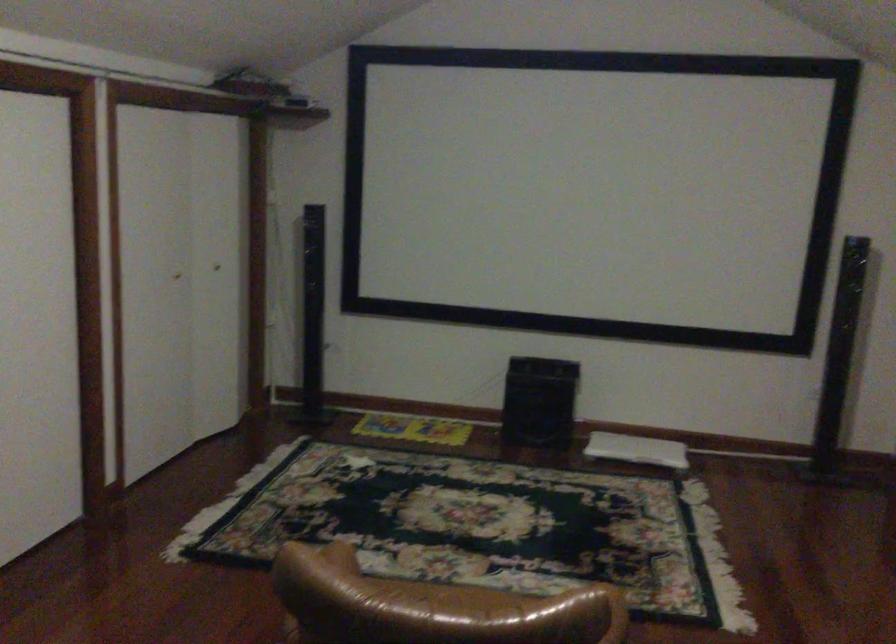
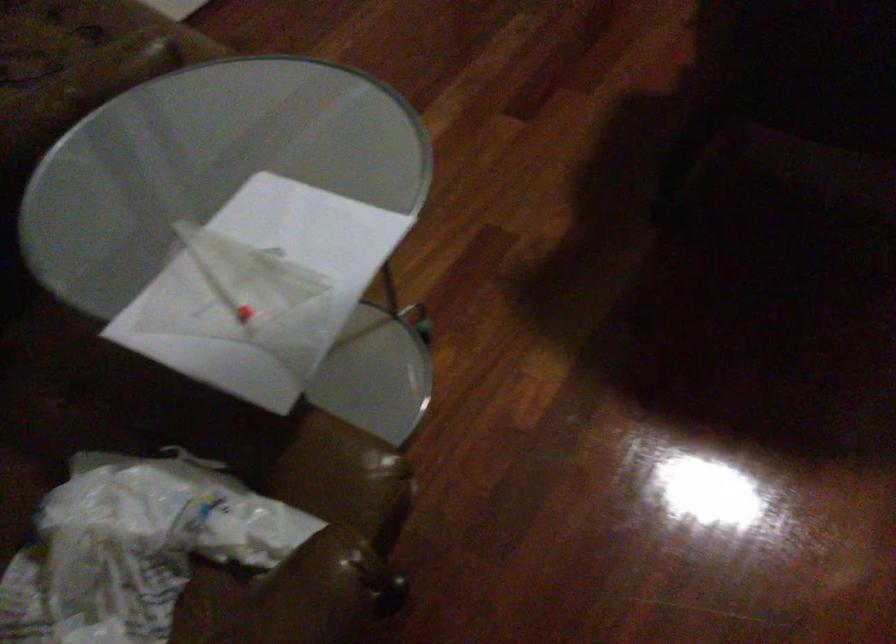
Based on the continuous images, in which direction is the camera rotating?

The camera's rotation is toward left-down.